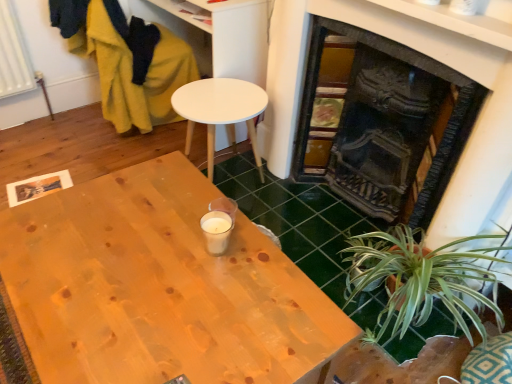
Image resolution: width=512 pixels, height=384 pixels. In order to click on empty space that is ontop of natural wood desk at center (from a real-world perspective) in this screenshot , I will do `click(131, 279)`.